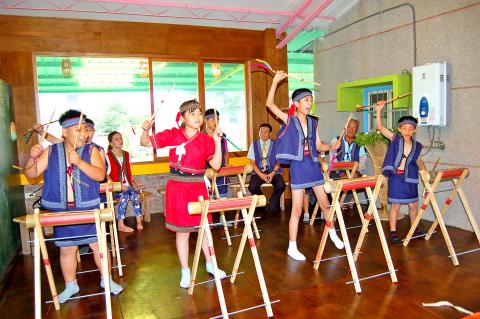
Locate an element on the screen. The image size is (480, 319). paper on floor is located at coordinates (445, 304).